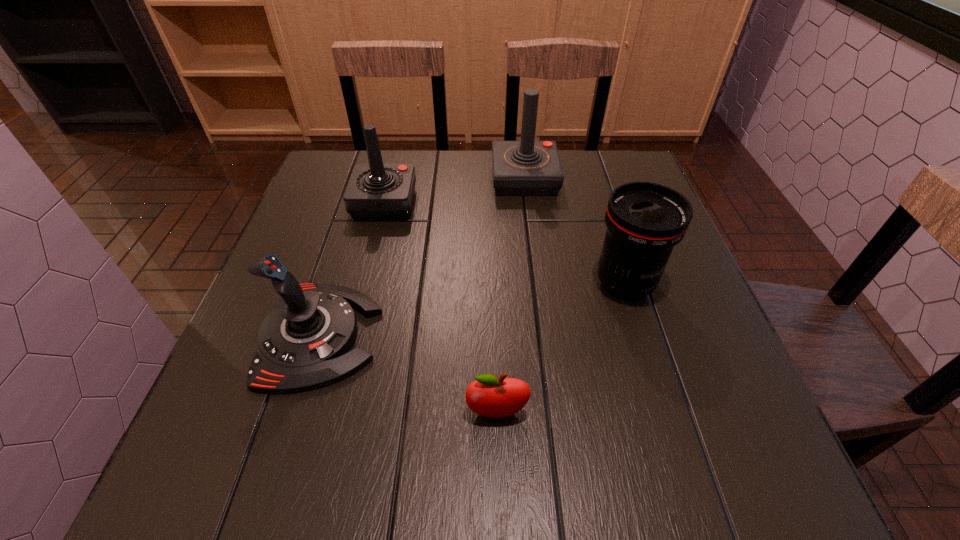
The image size is (960, 540). Identify the location of the rightmost joystick. (520, 168).

Locate an element on the screen. This screenshot has height=540, width=960. telephoto lens is located at coordinates (644, 220).

Where is `the nearest joystick`? This screenshot has width=960, height=540. the nearest joystick is located at coordinates (303, 343).

Image resolution: width=960 pixels, height=540 pixels. What are the coordinates of `apple` in the screenshot? It's located at (488, 396).

The image size is (960, 540). Find the location of `the nearest object`. the nearest object is located at coordinates (488, 396).

Find the location of a particular element. The height and width of the screenshot is (540, 960). free space located 0.370m on the rectangular base of the rightmost joystick is located at coordinates (356, 179).

At what (x,y) coordinates should I click in order to perform the action: click on vacant space located 0.340m on the rectangular base of the rightmost joystick. Please return your answer as a coordinate pair (x, y). The height and width of the screenshot is (540, 960). Looking at the image, I should click on (368, 179).

Locate an element on the screen. This screenshot has height=540, width=960. free space located 0.310m on the rectangular base of the rightmost joystick is located at coordinates (378, 179).

I want to click on free region located 0.370m on the left of the telephoto lens, so click(x=415, y=284).

The height and width of the screenshot is (540, 960). I want to click on vacant space located on the handle side of the nearest joystick, so click(558, 336).